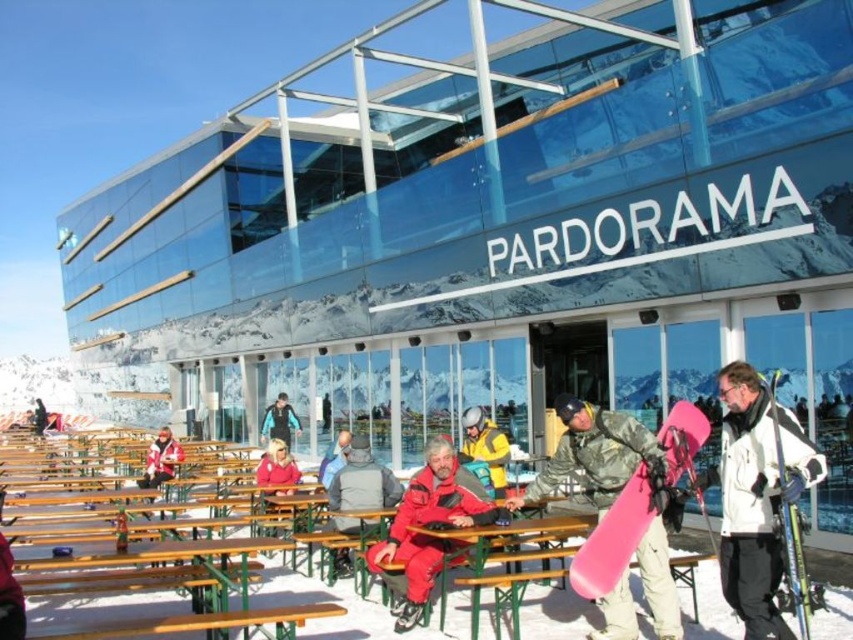
Looking at this image, can you confirm if pink matte snowboard at center is positioned to the right of matte yellow jacket at center?

Correct, you'll find pink matte snowboard at center to the right of matte yellow jacket at center.

Does pink matte snowboard at center appear over matte yellow jacket at center?

Yes, pink matte snowboard at center is above matte yellow jacket at center.

Image resolution: width=853 pixels, height=640 pixels. Find the location of `pink matte snowboard at center`. pink matte snowboard at center is located at coordinates (613, 538).

Consider the image. Who is more forward, (376, 570) or (329, 422)?

Point (376, 570)

Consider the image. Can you confirm if matte red ski suit at center is thinner than matte yellow jacket at center?

In fact, matte red ski suit at center might be wider than matte yellow jacket at center.

Where is `matte red ski suit at center`? The height and width of the screenshot is (640, 853). matte red ski suit at center is located at coordinates (428, 524).

Can you confirm if yellow matte jacket at center is taller than matte red jacket at center?

In fact, yellow matte jacket at center may be shorter than matte red jacket at center.

Can you confirm if yellow matte jacket at center is positioned to the left of matte red jacket at center?

No, yellow matte jacket at center is not to the left of matte red jacket at center.

The image size is (853, 640). What are the coordinates of `yellow matte jacket at center` in the screenshot? It's located at (486, 445).

At what (x,y) coordinates should I click in order to perform the action: click on yellow matte jacket at center. Please return your answer as a coordinate pair (x, y). Looking at the image, I should click on (486, 445).